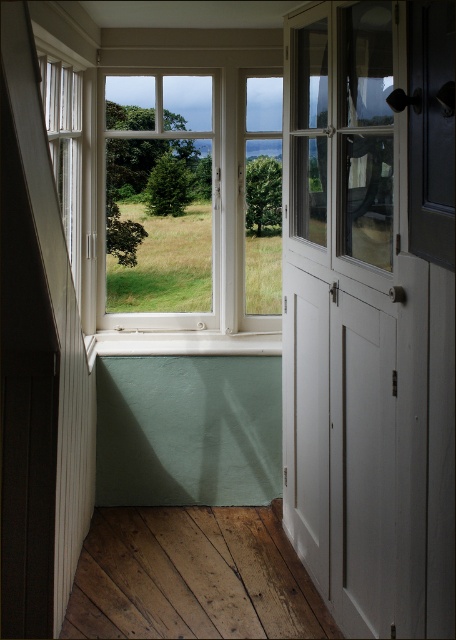
Question: Which object appears closest to the camera in this image?

Choices:
 (A) white wood screen door at right
 (B) white wooden window at center
 (C) white painted wood at lower center

Answer: (A)

Question: Which point is farther to the camera?

Choices:
 (A) white painted wood at lower center
 (B) white wood screen door at right
 (C) white wooden window at center

Answer: (C)

Question: In this image, where is white wood screen door at right located relative to white painted wood at lower center?

Choices:
 (A) below
 (B) above

Answer: (B)

Question: Considering the real-world distances, which object is farthest from the white painted wood at lower center?

Choices:
 (A) white wood screen door at right
 (B) white wooden window at center

Answer: (A)

Question: Is white wood screen door at right closer to camera compared to white painted wood at lower center?

Choices:
 (A) yes
 (B) no

Answer: (A)

Question: Can you confirm if white wood screen door at right is positioned to the left of white painted wood at lower center?

Choices:
 (A) no
 (B) yes

Answer: (A)